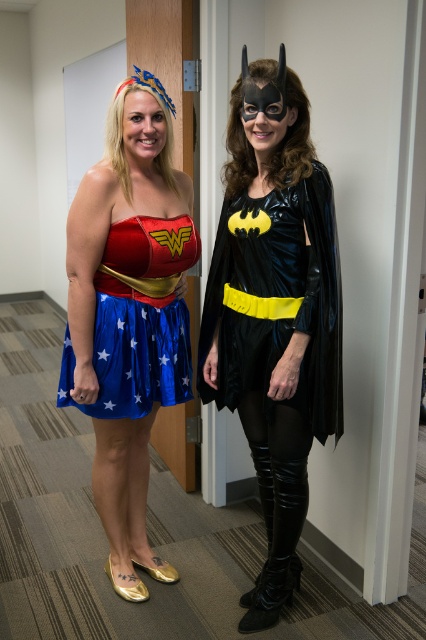
Question: Is shiny blue skirt at center smaller than shiny black cape at center?

Choices:
 (A) yes
 (B) no

Answer: (B)

Question: Can you confirm if shiny satin skirt at left is smaller than shiny blue skirt at center?

Choices:
 (A) yes
 (B) no

Answer: (B)

Question: Which object appears farthest from the camera in this image?

Choices:
 (A) shiny black cape at center
 (B) blue shiny dress at center
 (C) shiny satin skirt at left

Answer: (B)

Question: Which point is closer to the camera taking this photo?

Choices:
 (A) (328, 250)
 (B) (233, 220)
 (C) (126, 355)

Answer: (A)

Question: Estimate the real-world distances between objects in this image. Which object is farther from the blue shiny dress at center?

Choices:
 (A) shiny black cape at center
 (B) shiny blue skirt at center
 (C) shiny satin skirt at left

Answer: (A)

Question: Can you confirm if shiny blue skirt at center is positioned to the right of blue shiny dress at center?

Choices:
 (A) yes
 (B) no

Answer: (B)